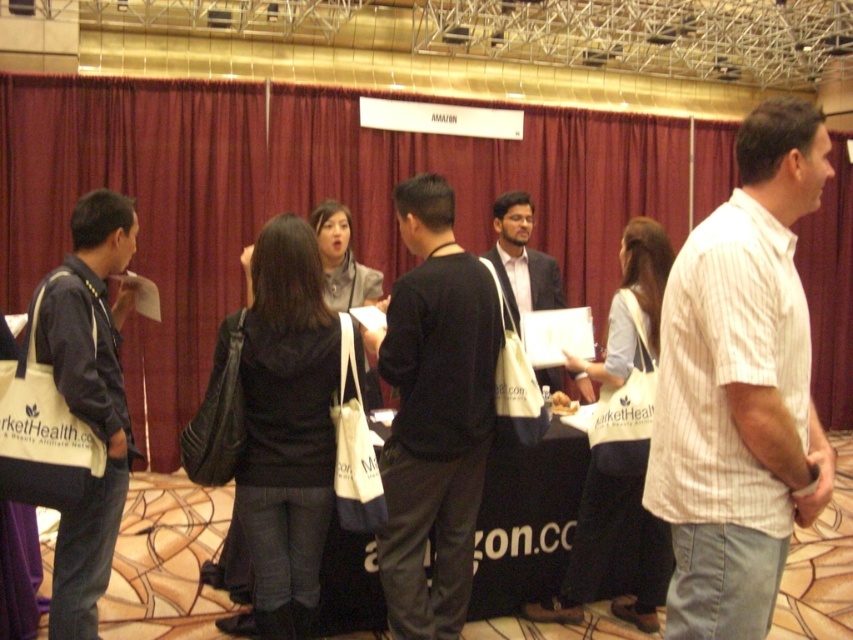
Which is in front, point (488, 401) or point (525, 289)?

Positioned in front is point (488, 401).

Which is in front, point (410, 467) or point (495, 209)?

Point (410, 467) is in front.

I want to click on black matte shirt at center, so click(434, 413).

Can you confirm if white striped shirt at right is taller than black matte shirt at center?

No, white striped shirt at right is not taller than black matte shirt at center.

Does white striped shirt at right lie behind black matte shirt at center?

That is False.

This screenshot has height=640, width=853. Identify the location of white striped shirt at right. (740, 387).

At what (x,y) coordinates should I click in order to perform the action: click on white striped shirt at right. Please return your answer as a coordinate pair (x, y). Image resolution: width=853 pixels, height=640 pixels. Looking at the image, I should click on (740, 387).

Who is higher up, white striped shirt at right or matte black jacket at left?

white striped shirt at right is higher up.

Based on the photo, is white striped shirt at right to the right of matte black jacket at left from the viewer's perspective?

Correct, you'll find white striped shirt at right to the right of matte black jacket at left.

Is point (809, 378) positioned in front of point (74, 547)?

Yes, point (809, 378) is in front of point (74, 547).

The height and width of the screenshot is (640, 853). What are the coordinates of `white striped shirt at right` in the screenshot? It's located at (740, 387).